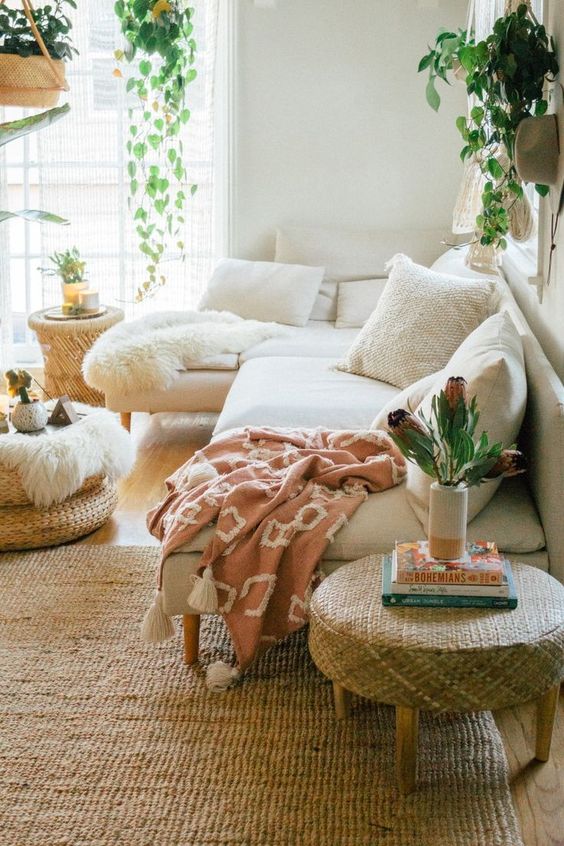
This screenshot has width=564, height=846. I want to click on tables, so click(x=39, y=445), click(x=79, y=430), click(x=70, y=470), click(x=354, y=608), click(x=425, y=629), click(x=515, y=613), click(x=80, y=320), click(x=59, y=317).